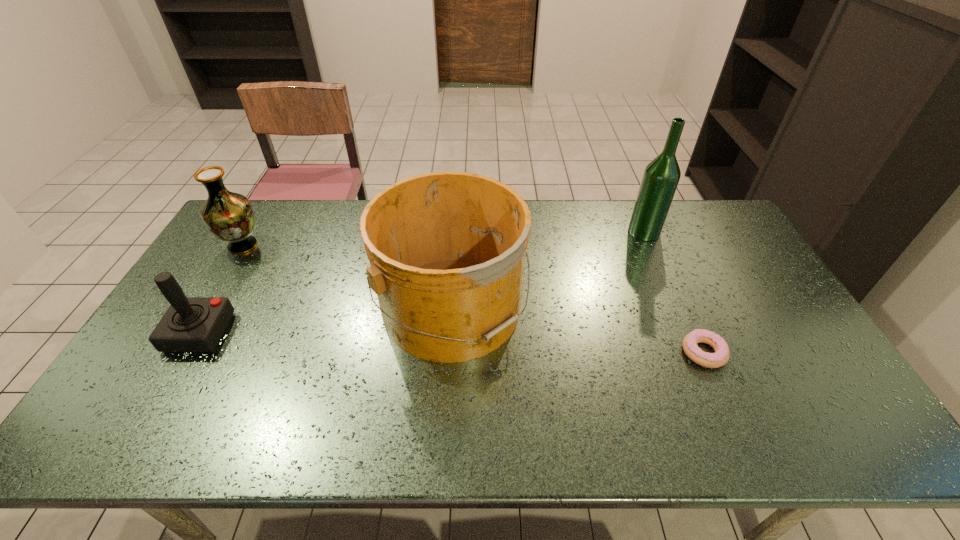
The image size is (960, 540). What are the coordinates of `free area in between the bucket and the vase` in the screenshot? It's located at (348, 276).

Locate an element on the screen. This screenshot has width=960, height=540. blank region between the third shortest object and the third object from right to left is located at coordinates (348, 276).

The width and height of the screenshot is (960, 540). I want to click on vacant space in between the bucket and the joystick, so click(x=326, y=320).

This screenshot has width=960, height=540. Find the location of `empty space that is in between the shortest object and the tallest object`. empty space that is in between the shortest object and the tallest object is located at coordinates (674, 292).

Where is `free area in between the second shortest object and the vase`? This screenshot has width=960, height=540. free area in between the second shortest object and the vase is located at coordinates (221, 289).

Find the location of a particular element. empty space between the joystick and the third object from right to left is located at coordinates (326, 320).

Identify which object is the third nearest to the vase. Please provide its 2D coordinates. Your answer should be formatted as a tuple, i.e. [(x, y)], where the tuple contains the x and y coordinates of a point satisfying the conditions above.

[(661, 176)]

What are the coordinates of `the fourth closest object to the joystick` in the screenshot? It's located at (x=661, y=176).

Where is `vacant region that satisfies the following two spatial constraints: 1. on the back side of the vase; 2. on the left side of the tallest object`? vacant region that satisfies the following two spatial constraints: 1. on the back side of the vase; 2. on the left side of the tallest object is located at coordinates (252, 232).

This screenshot has height=540, width=960. I want to click on vacant region that satisfies the following two spatial constraints: 1. on the front side of the doughnut; 2. on the right side of the tallest object, so click(x=696, y=353).